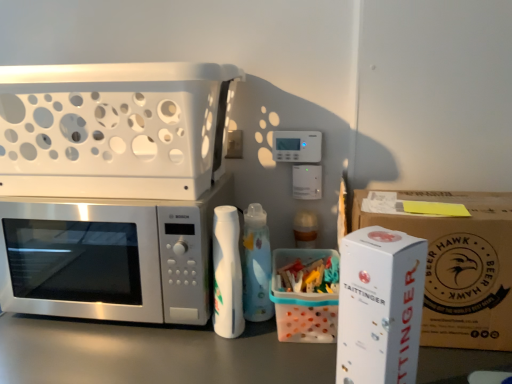
Question: Considering the positions of point (102, 228) and point (382, 236), is point (102, 228) closer or farther from the camera than point (382, 236)?

Choices:
 (A) closer
 (B) farther

Answer: (B)

Question: Is satin silver microwave at left spatially inside white cardboard box at right, the 2th appliance positioned from the back, or outside of it?

Choices:
 (A) outside
 (B) inside

Answer: (A)

Question: Estimate the real-world distances between objects in this image. Which object is farther from the translucent plastic container at center, which ranks as the second cardboard box in right-to-left order?

Choices:
 (A) satin silver microwave at left
 (B) white plastic basket at upper left, which is the first appliance in back-to-front order
 (C) white cardboard box at right, the 1th cardboard box when ordered from right to left
 (D) white cardboard box at right, which is counted as the second appliance, starting from the left

Answer: (B)

Question: Which object is the closest to the white plastic basket at upper left, the second appliance when ordered from bottom to top?

Choices:
 (A) translucent plastic container at center, the first cardboard box positioned from the left
 (B) white cardboard box at right, the 1th appliance ordered from the bottom
 (C) white cardboard box at right, the 1th cardboard box when ordered from right to left
 (D) satin silver microwave at left

Answer: (D)